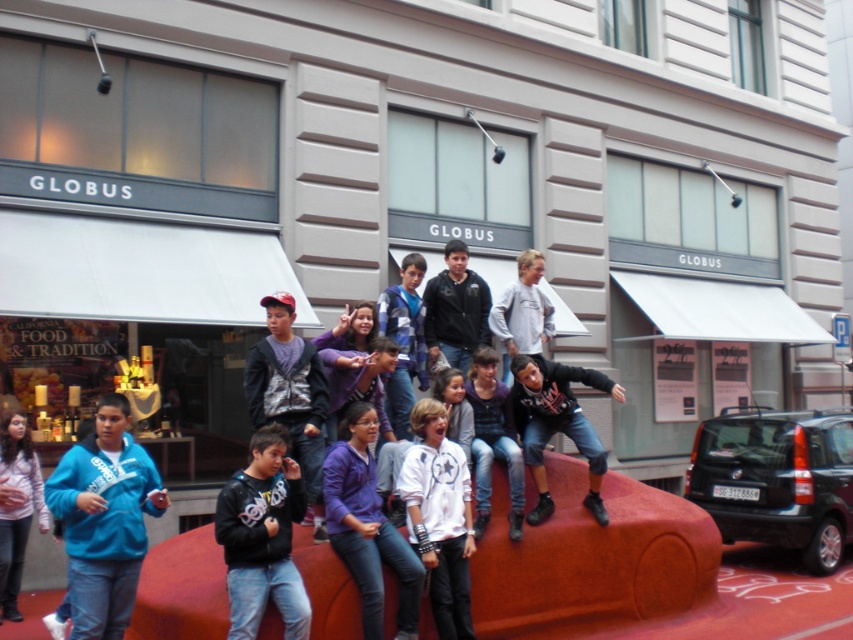
Can you confirm if blue fleece jacket at lower left is bigger than dark gray hoodie at center?

Yes.

Does point (131, 582) lie in front of point (257, 356)?

Yes.

Where is `blue fleece jacket at lower left`? The width and height of the screenshot is (853, 640). blue fleece jacket at lower left is located at coordinates (103, 518).

Can you confirm if matte pink sweater at lower left is taller than dark blue jacket at center?

Yes.

Is point (9, 480) farther from viewer compared to point (425, 308)?

That is False.

Find the location of a particular element. This screenshot has width=853, height=640. matte pink sweater at lower left is located at coordinates (16, 506).

Does white matte shirt at center appear on the right side of dark gray hoodie at center?

Indeed, white matte shirt at center is positioned on the right side of dark gray hoodie at center.

Between white matte shirt at center and dark gray hoodie at center, which one has more height?

With more height is dark gray hoodie at center.

Is point (437, 557) in front of point (293, 362)?

Yes, point (437, 557) is closer to viewer.

Where is `white matte shirt at center`? This screenshot has width=853, height=640. white matte shirt at center is located at coordinates pyautogui.click(x=439, y=516).